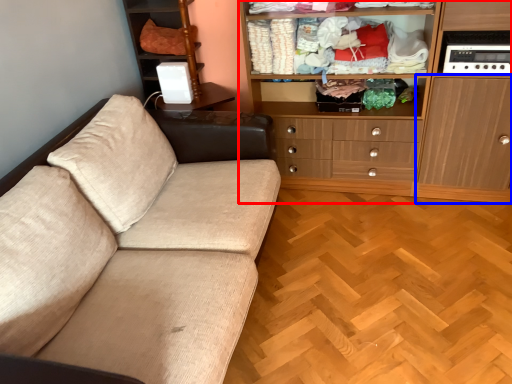
Question: Which object appears closest to the camera in this image, cabinetry (highlighted by a red box) or cabinetry (highlighted by a blue box)?

Choices:
 (A) cabinetry
 (B) cabinetry

Answer: (B)